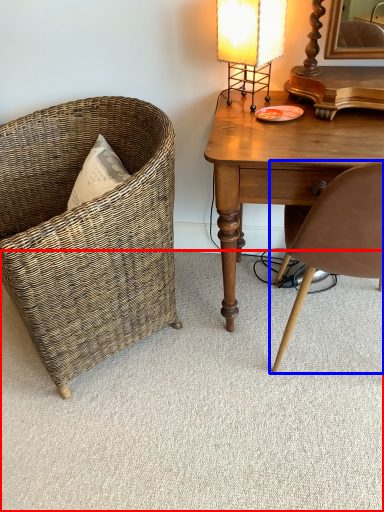
Question: Which point is further to the camera, plain (highlighted by a red box) or chair (highlighted by a blue box)?

Choices:
 (A) plain
 (B) chair

Answer: (A)